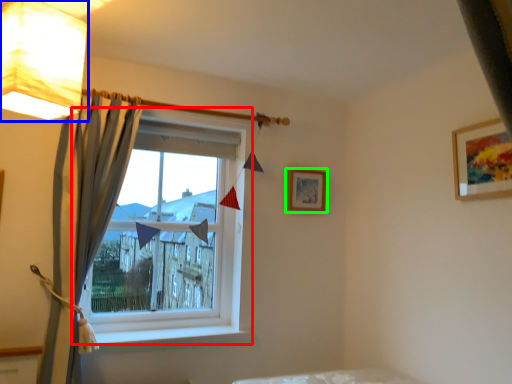
Question: Which is nearer to the window (highlighted by a red box)? lamp (highlighted by a blue box) or picture frame (highlighted by a green box).

Choices:
 (A) lamp
 (B) picture frame

Answer: (B)